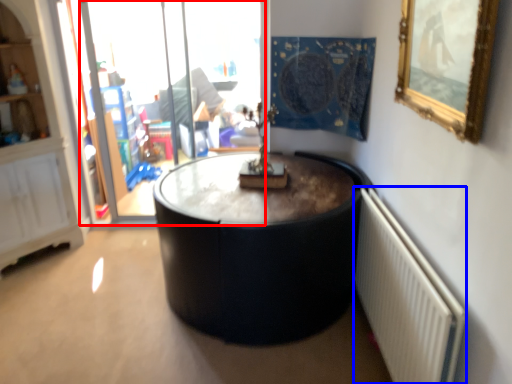
Question: Which of the following is the closest to the observer, glass door (highlighted by a red box) or radiator (highlighted by a blue box)?

Choices:
 (A) glass door
 (B) radiator

Answer: (B)